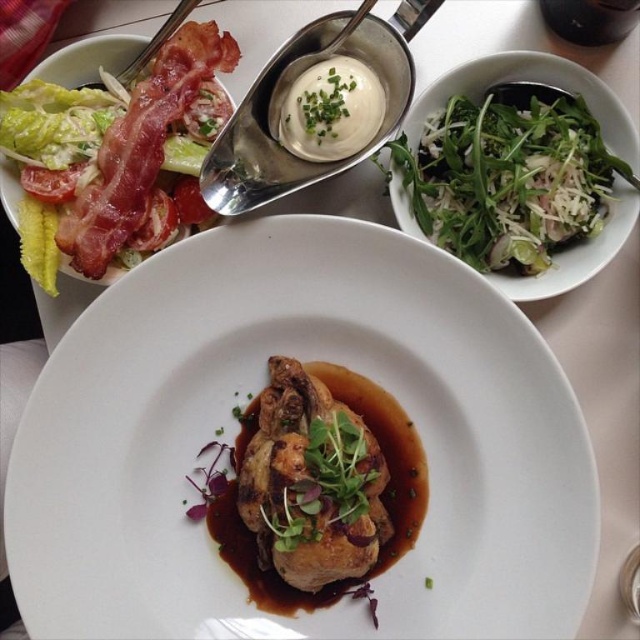
Question: Which object is the farthest from the brown crispy chicken at center?

Choices:
 (A) shiny red bacon at upper left
 (B) satin silver spoon at upper center
 (C) brown glazed chicken at center

Answer: (A)

Question: Does shiny red bacon at upper left appear on the right side of satin silver spoon at upper center?

Choices:
 (A) yes
 (B) no

Answer: (B)

Question: Does brown glazed chicken at center appear on the right side of brown crispy chicken at center?

Choices:
 (A) yes
 (B) no

Answer: (B)

Question: Which point is farther to the camera?

Choices:
 (A) (308, 84)
 (B) (547, 138)
 (C) (230, 156)
 (D) (202, 451)

Answer: (D)

Question: Where is shiny red bacon at upper left located in relation to satin silver spoon at upper center in the image?

Choices:
 (A) left
 (B) right

Answer: (A)

Question: Considering the real-world distances, which object is farthest from the brown glazed chicken at center?

Choices:
 (A) green leafy salad at upper right
 (B) brown crispy chicken at center

Answer: (A)